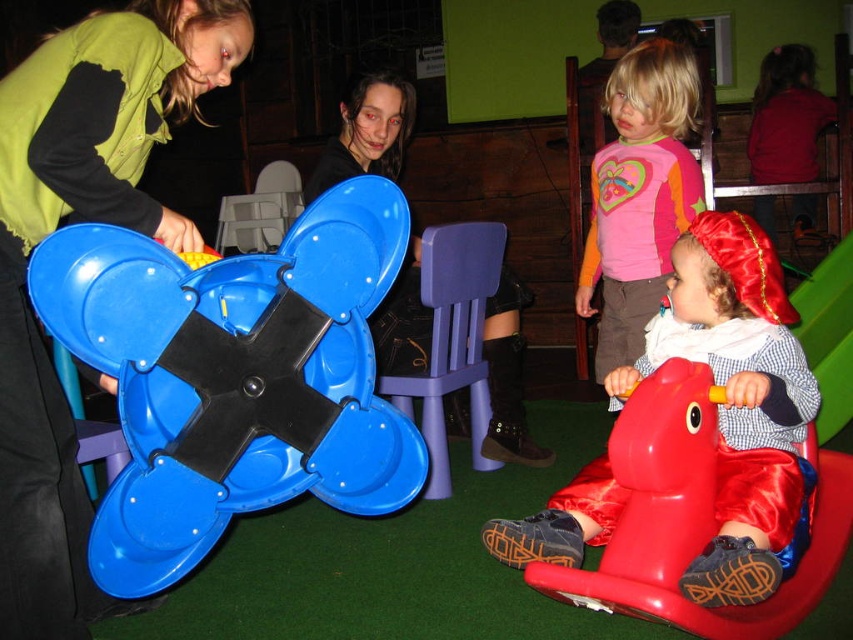
Question: Among these points, which one is farthest from the camera?

Choices:
 (A) (90, 552)
 (B) (820, 536)
 (C) (746, 269)

Answer: (B)

Question: Is blue plastic spinner at left bigger than rubberized plastic rocking horse at lower right?

Choices:
 (A) yes
 (B) no

Answer: (A)

Question: Does rubberized plastic rocking horse at lower right appear on the right side of pink fabric shirt at upper center?

Choices:
 (A) no
 (B) yes

Answer: (A)

Question: Which object appears farthest from the camera in this image?

Choices:
 (A) blue plastic spinner at left
 (B) green matte vest at upper left
 (C) matte black chair at center

Answer: (C)

Question: Which point is farther to the camera?

Choices:
 (A) (695, 460)
 (B) (630, 225)
 (C) (497, 458)

Answer: (C)

Question: Can you confirm if rubberized plastic rocking horse at lower right is smaller than pink fabric shirt at upper center?

Choices:
 (A) yes
 (B) no

Answer: (A)